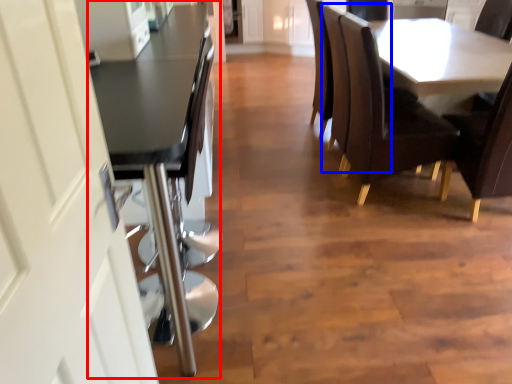
Question: Which object is further to the camera taking this photo, table (highlighted by a red box) or armchair (highlighted by a blue box)?

Choices:
 (A) table
 (B) armchair

Answer: (B)